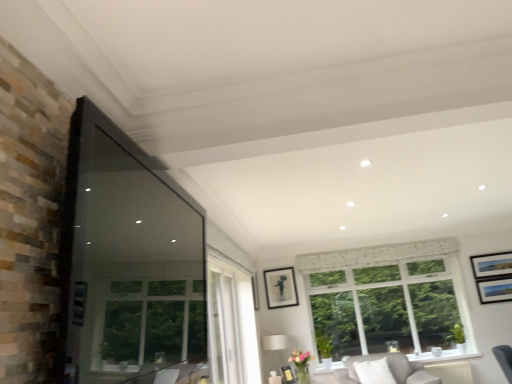
Question: Looking at the image, does black glossy picture frame at center, placed as the second picture frame when sorted from bottom to top, seem bigger or smaller compared to matte black picture frame at lower center, which is counted as the 3th picture frame, starting from the top?

Choices:
 (A) small
 (B) big

Answer: (B)

Question: From the image's perspective, relative to matte black picture frame at lower center, which is the first picture frame in bottom-to-top order, is black glossy picture frame at center, placed as the second picture frame when sorted from bottom to top, above or below?

Choices:
 (A) below
 (B) above

Answer: (B)

Question: Which object is the closest to the transparent glass window screen at left?

Choices:
 (A) matte black picture frame at lower center, which is the first picture frame in bottom-to-top order
 (B) matte white lampshade at center
 (C) light gray fabric couch at lower right
 (D) white lace curtain at upper center
 (E) black glossy picture frame at center, the second picture frame from the top

Answer: (B)

Question: Which object is positioned farthest from the black glossy picture frame at center, the second picture frame from the top?

Choices:
 (A) matte black picture frame at lower center, which is the first picture frame in bottom-to-top order
 (B) white lace curtain at upper center
 (C) matte black picture frame at center, the first picture frame in the top-to-bottom sequence
 (D) transparent glass window screen at left
 (E) light gray fabric couch at lower right

Answer: (D)